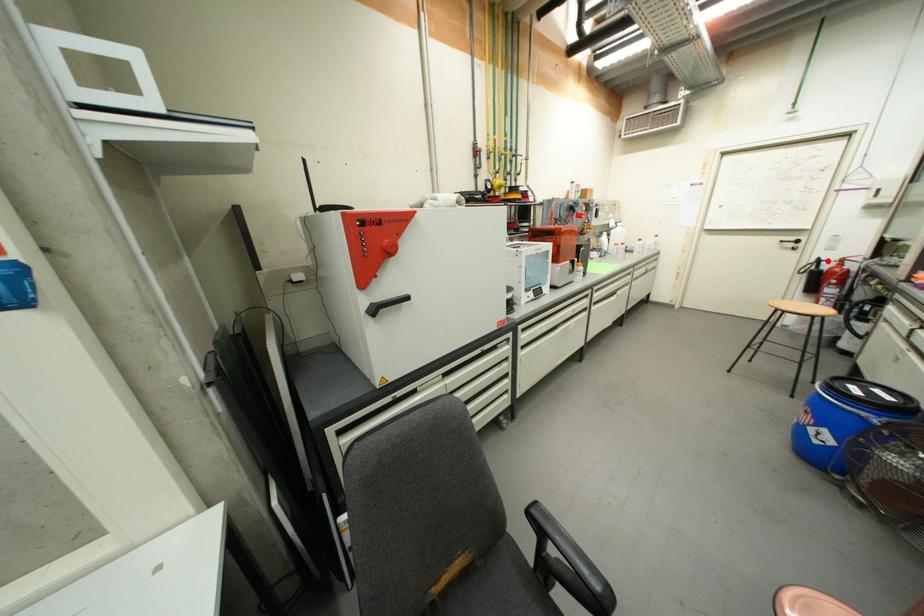
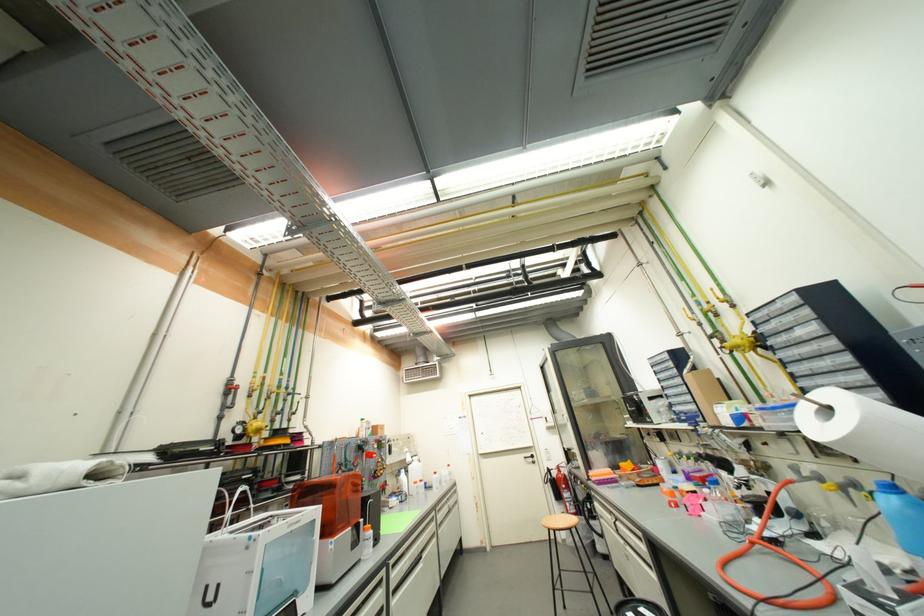
Locate, in the second image, the point that corresponds to the highlighted location in the first image.

(554, 469)